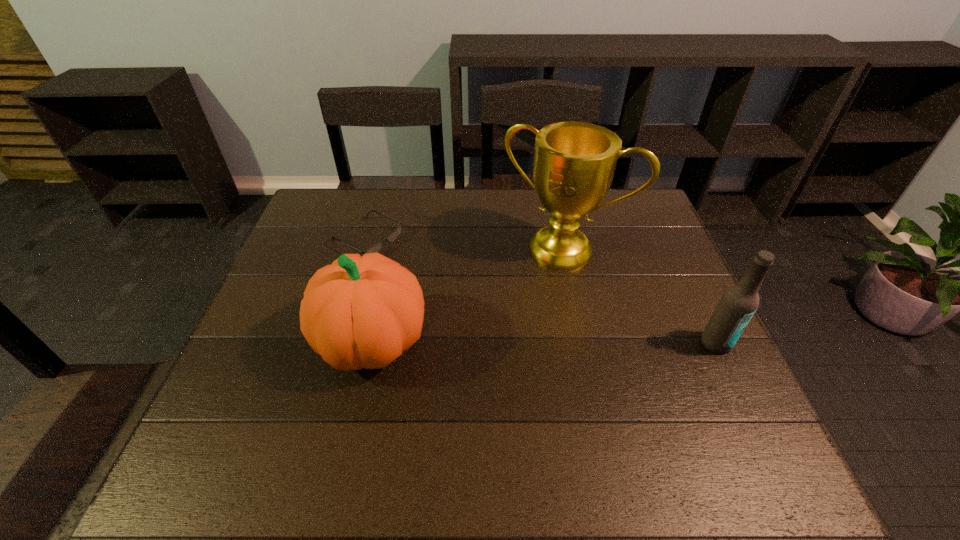
This screenshot has width=960, height=540. What are the coordinates of `vacant area situated on the front-facing side of the spectacles` in the screenshot? It's located at (476, 295).

The image size is (960, 540). I want to click on blank area located on the front-facing side of the spectacles, so click(x=479, y=296).

Find the location of a particular element. Image resolution: width=960 pixels, height=540 pixels. vacant space situated 0.270m on the front-facing side of the spectacles is located at coordinates (468, 290).

At what (x,y) coordinates should I click in order to perform the action: click on award that is positioned at the far edge. Please return your answer as a coordinate pair (x, y). The image size is (960, 540). Looking at the image, I should click on (574, 163).

Identify the location of spectacles situated at the far edge. (376, 248).

The image size is (960, 540). Identify the location of object that is at the near edge. (359, 312).

You are a GUI agent. You are given a task and a screenshot of the screen. Output one action in this format:
    pyautogui.click(x=<x>, y=<y>)
    Task: Click on the object that is positioned at the left edge
    The image size is (960, 540).
    Given the screenshot: What is the action you would take?
    pyautogui.click(x=376, y=248)

The width and height of the screenshot is (960, 540). I want to click on beer bottle at the right edge, so click(739, 302).

The width and height of the screenshot is (960, 540). I want to click on award that is at the right edge, so click(574, 163).

The height and width of the screenshot is (540, 960). What are the coordinates of `object that is at the far left corner` in the screenshot? It's located at (376, 248).